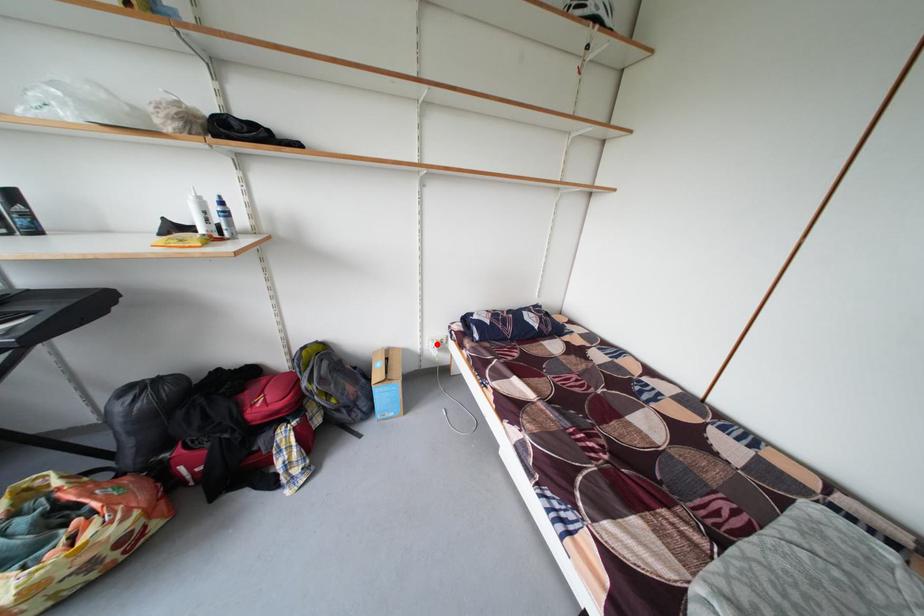
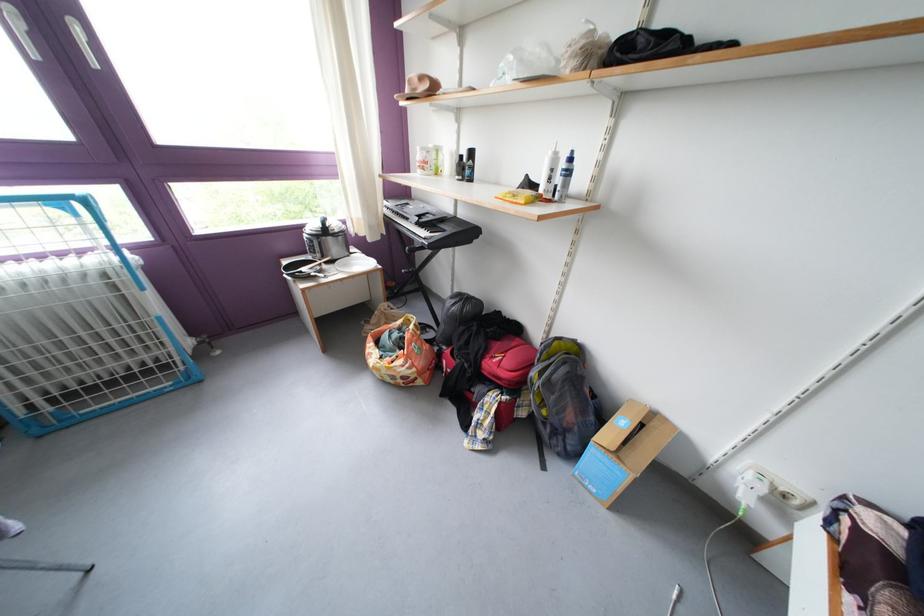
The point at the highlighted location is marked in the first image. Where is the corresponding point in the second image?

(758, 467)